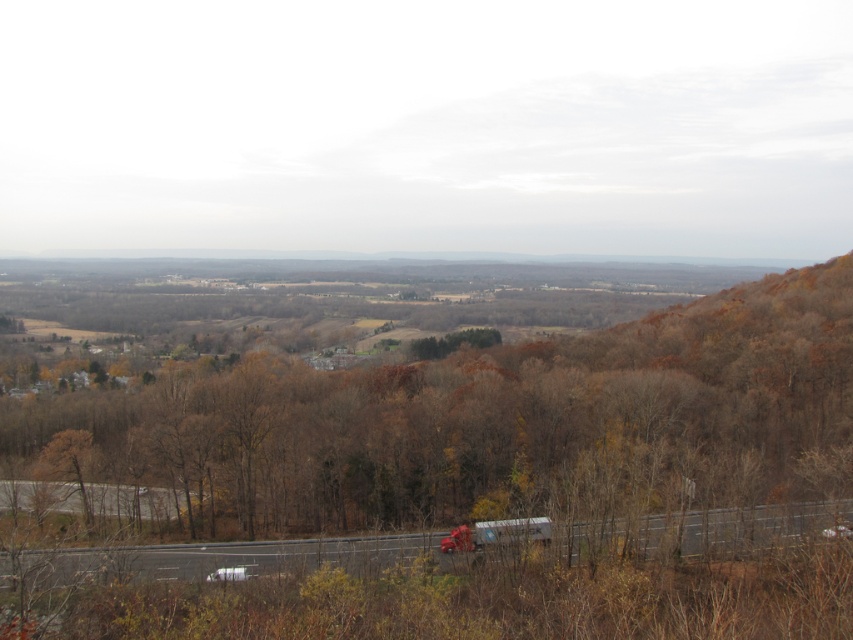
Does brown matte tree at center come in front of metallic silver truck at lower center?

No, it is behind metallic silver truck at lower center.

Does brown matte tree at center have a lesser height compared to metallic silver truck at lower center?

No, brown matte tree at center is not shorter than metallic silver truck at lower center.

Is point (595, 465) farther from camera compared to point (775, 509)?

That is True.

The width and height of the screenshot is (853, 640). Find the location of `brown matte tree at center`. brown matte tree at center is located at coordinates (479, 424).